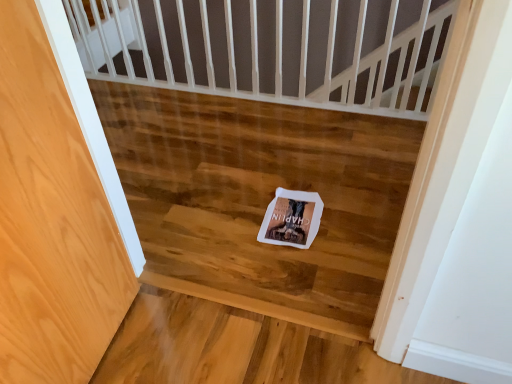
This screenshot has width=512, height=384. In order to click on vacant space in front of white paper postcard at center in this screenshot , I will do `click(298, 265)`.